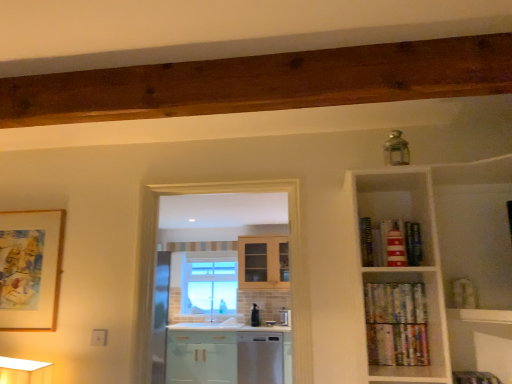
Question: Can you confirm if wooden picture frame at left is wider than clear glass window at center?

Choices:
 (A) no
 (B) yes

Answer: (A)

Question: From the image's perspective, is wooden picture frame at left below clear glass window at center?

Choices:
 (A) no
 (B) yes

Answer: (A)

Question: From the image's perspective, is wooden picture frame at left above clear glass window at center?

Choices:
 (A) no
 (B) yes

Answer: (B)

Question: Is wooden picture frame at left looking in the opposite direction of clear glass window at center?

Choices:
 (A) yes
 (B) no

Answer: (A)

Question: Are wooden picture frame at left and clear glass window at center located far from each other?

Choices:
 (A) yes
 (B) no

Answer: (A)

Question: Does wooden picture frame at left have a smaller size compared to clear glass window at center?

Choices:
 (A) yes
 (B) no

Answer: (A)

Question: Is satin white dishwasher at center to the left of wooden picture frame at left from the viewer's perspective?

Choices:
 (A) no
 (B) yes

Answer: (A)

Question: Does satin white dishwasher at center come behind wooden picture frame at left?

Choices:
 (A) yes
 (B) no

Answer: (A)

Question: Is satin white dishwasher at center aimed at wooden picture frame at left?

Choices:
 (A) no
 (B) yes

Answer: (B)

Question: Can you confirm if satin white dishwasher at center is thinner than wooden picture frame at left?

Choices:
 (A) no
 (B) yes

Answer: (A)

Question: Is satin white dishwasher at center turned away from wooden picture frame at left?

Choices:
 (A) yes
 (B) no

Answer: (B)

Question: Could wooden picture frame at left be considered to be inside satin white dishwasher at center?

Choices:
 (A) yes
 (B) no

Answer: (B)

Question: Is hardcover books at right, the second book positioned from the top, aimed at red striped lighthouse at upper right, placed as the 1th book when sorted from top to bottom?

Choices:
 (A) yes
 (B) no

Answer: (B)